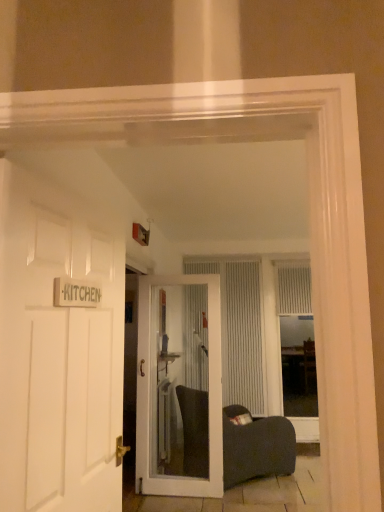
Measure the distance between point (289,294) and camera.

Point (289,294) is 5.88 meters from camera.

This screenshot has width=384, height=512. Identify the location of white textured curtain at center, the second curtain from the right. (239, 330).

Find the location of `clear glass door at center, acting as the 1th door starting from the back`. clear glass door at center, acting as the 1th door starting from the back is located at coordinates (150, 395).

This screenshot has width=384, height=512. Identify the location of white textured curtain at center, which ranks as the second curtain in left-to-right order. (294, 288).

At what (x,y) coordinates should I click in order to perform the action: click on white textured blinds at center. Please return your answer as a coordinate pair (x, y). The height and width of the screenshot is (512, 384). Looking at the image, I should click on (297, 339).

In the scene shown: Looking at the image, does white textured blinds at center seem bigger or smaller compared to white textured curtain at center, which ranks as the second curtain in left-to-right order?

white textured blinds at center is bigger than white textured curtain at center, which ranks as the second curtain in left-to-right order.

Is white textured blinds at center to the left or to the right of white textured curtain at center, acting as the first curtain starting from the right, in the image?

From the image, it's evident that white textured blinds at center is to the right of white textured curtain at center, acting as the first curtain starting from the right.

Which is in front, point (286, 397) or point (279, 274)?

The point (279, 274) is closer.

Considering the positions of objects white textured blinds at center and white textured curtain at center, acting as the first curtain starting from the right, in the image provided, who is in front, white textured blinds at center or white textured curtain at center, acting as the first curtain starting from the right,?

Positioned in front is white textured blinds at center.

Based on the photo, is white wooden door at left, the first door viewed from the front, at the back of white textured curtain at center, the second curtain from the right?

No, white textured curtain at center, the second curtain from the right, is not facing away from white wooden door at left, the first door viewed from the front.

Does white textured curtain at center, which appears as the 1th curtain when viewed from the left, have a smaller size compared to white wooden door at left, the first door viewed from the front?

Actually, white textured curtain at center, which appears as the 1th curtain when viewed from the left, might be larger than white wooden door at left, the first door viewed from the front.

Could you measure the distance between white textured curtain at center, the second curtain from the right, and white wooden door at left, the first door viewed from the front?

white textured curtain at center, the second curtain from the right, and white wooden door at left, the first door viewed from the front, are 12.99 feet apart from each other.

Between white textured curtain at center, the second curtain from the right, and white wooden door at left, the first door viewed from the front, which one has smaller width?

With smaller width is white textured curtain at center, the second curtain from the right.

In the scene shown: Is white wooden door at left, arranged as the second door when viewed from the back, next to white textured curtain at center, which ranks as the second curtain in left-to-right order, and touching it?

white wooden door at left, arranged as the second door when viewed from the back, and white textured curtain at center, which ranks as the second curtain in left-to-right order, are clearly separated.

Does white wooden door at left, arranged as the second door when viewed from the back, have a lesser width compared to white textured curtain at center, which ranks as the second curtain in left-to-right order?

Yes.

Identify the location of the 2nd curtain to the right of the white wooden door at left, arranged as the second door when viewed from the back, starting your count from the anchor. (294, 288).

Is white wooden door at left, the first door viewed from the front, not within white textured curtain at center, which ranks as the second curtain in left-to-right order?

Yes.

Between white textured blinds at center and clear glass door at center, positioned as the second door in front-to-back order, which one is positioned behind?

white textured blinds at center is behind.

What's the angular difference between white textured blinds at center and clear glass door at center, positioned as the second door in front-to-back order,'s facing directions?

The facing directions of white textured blinds at center and clear glass door at center, positioned as the second door in front-to-back order, are 5.16 degrees apart.

Is white textured blinds at center next to clear glass door at center, positioned as the second door in front-to-back order?

white textured blinds at center and clear glass door at center, positioned as the second door in front-to-back order, are not in contact.

Who is smaller, white textured blinds at center or clear glass door at center, positioned as the second door in front-to-back order?

white textured blinds at center is smaller.

Who is more distant, white textured curtain at center, which ranks as the second curtain in left-to-right order, or white textured curtain at center, the second curtain from the right?

white textured curtain at center, which ranks as the second curtain in left-to-right order, is further from the camera.

Can you confirm if white textured curtain at center, acting as the first curtain starting from the right, is smaller than white textured curtain at center, the second curtain from the right?

Yes.

From the image's perspective, is white textured curtain at center, which ranks as the second curtain in left-to-right order, located beneath white textured curtain at center, the second curtain from the right?

No, from the image's perspective, white textured curtain at center, which ranks as the second curtain in left-to-right order, is not below white textured curtain at center, the second curtain from the right.

Is white textured curtain at center, which ranks as the second curtain in left-to-right order, taller than white textured curtain at center, the second curtain from the right?

No.

Between clear glass door at center, acting as the 1th door starting from the back, and white textured blinds at center, which one appears on the left side from the viewer's perspective?

From the viewer's perspective, clear glass door at center, acting as the 1th door starting from the back, appears more on the left side.

Is there a large distance between clear glass door at center, positioned as the second door in front-to-back order, and white textured blinds at center?

Yes, clear glass door at center, positioned as the second door in front-to-back order, is far from white textured blinds at center.

Is clear glass door at center, acting as the 1th door starting from the back, turned away from white textured blinds at center?

No, clear glass door at center, acting as the 1th door starting from the back,'s orientation is not away from white textured blinds at center.

From the image's perspective, which is above, clear glass door at center, positioned as the second door in front-to-back order, or white textured blinds at center?

From the image's view, clear glass door at center, positioned as the second door in front-to-back order, is above.

Is white textured blinds at center bigger or smaller than white wooden door at left, the first door viewed from the front?

Clearly, white textured blinds at center is larger in size than white wooden door at left, the first door viewed from the front.

Considering the relative sizes of white textured blinds at center and white wooden door at left, the first door viewed from the front, in the image provided, is white textured blinds at center taller than white wooden door at left, the first door viewed from the front,?

Correct, white textured blinds at center is much taller as white wooden door at left, the first door viewed from the front.

Is white textured blinds at center to the right of white wooden door at left, the first door viewed from the front, from the viewer's perspective?

Yes.

Where is `window located behind the white wooden door at left, the first door viewed from the front`? The image size is (384, 512). window located behind the white wooden door at left, the first door viewed from the front is located at coordinates (297, 339).

This screenshot has height=512, width=384. I want to click on window that appears below the white textured curtain at center, which ranks as the second curtain in left-to-right order (from a real-world perspective), so click(297, 339).

Where is `the 2nd door in front when counting from the white textured curtain at center, the second curtain from the right`? The height and width of the screenshot is (512, 384). the 2nd door in front when counting from the white textured curtain at center, the second curtain from the right is located at coordinates (58, 354).

Consider the image. Considering their positions, is white textured curtain at center, which ranks as the second curtain in left-to-right order, positioned further to white wooden door at left, arranged as the second door when viewed from the back, than white textured blinds at center?

white textured blinds at center is further to white wooden door at left, arranged as the second door when viewed from the back.

Looking at the image, which one is located further to white textured curtain at center, which appears as the 1th curtain when viewed from the left, clear glass door at center, positioned as the second door in front-to-back order, or white textured curtain at center, which ranks as the second curtain in left-to-right order?

Among the two, clear glass door at center, positioned as the second door in front-to-back order, is located further to white textured curtain at center, which appears as the 1th curtain when viewed from the left.

Estimate the real-world distances between objects in this image. Which object is closer to white textured curtain at center, which appears as the 1th curtain when viewed from the left, white textured blinds at center or white textured curtain at center, which ranks as the second curtain in left-to-right order?

The object closer to white textured curtain at center, which appears as the 1th curtain when viewed from the left, is white textured blinds at center.

Which object lies further to the anchor point white textured curtain at center, which appears as the 1th curtain when viewed from the left, white wooden door at left, the first door viewed from the front, or white textured blinds at center?

Based on the image, white wooden door at left, the first door viewed from the front, appears to be further to white textured curtain at center, which appears as the 1th curtain when viewed from the left.

Considering their positions, is white textured curtain at center, the second curtain from the right, positioned further to clear glass door at center, acting as the 1th door starting from the back, than white textured curtain at center, which ranks as the second curtain in left-to-right order?

The object further to clear glass door at center, acting as the 1th door starting from the back, is white textured curtain at center, which ranks as the second curtain in left-to-right order.

From the image, which object appears to be nearer to white textured curtain at center, acting as the first curtain starting from the right, white textured curtain at center, which appears as the 1th curtain when viewed from the left, or white textured blinds at center?

white textured blinds at center is positioned closer to the anchor white textured curtain at center, acting as the first curtain starting from the right.

Which object lies further to the anchor point white textured curtain at center, which ranks as the second curtain in left-to-right order, white wooden door at left, the first door viewed from the front, or white textured curtain at center, the second curtain from the right?

white wooden door at left, the first door viewed from the front, is further to white textured curtain at center, which ranks as the second curtain in left-to-right order.

When comparing their distances from white wooden door at left, arranged as the second door when viewed from the back, does white textured blinds at center or white textured curtain at center, acting as the first curtain starting from the right, seem closer?

white textured curtain at center, acting as the first curtain starting from the right, is closer to white wooden door at left, arranged as the second door when viewed from the back.

Where is `curtain between white textured curtain at center, which appears as the 1th curtain when viewed from the left, and white textured blinds at center`? The height and width of the screenshot is (512, 384). curtain between white textured curtain at center, which appears as the 1th curtain when viewed from the left, and white textured blinds at center is located at coordinates (294, 288).

This screenshot has height=512, width=384. I want to click on window between clear glass door at center, acting as the 1th door starting from the back, and white textured curtain at center, the second curtain from the right, in the front-back direction, so click(297, 339).

The height and width of the screenshot is (512, 384). Find the location of `curtain between clear glass door at center, acting as the 1th door starting from the back, and white textured curtain at center, acting as the first curtain starting from the right, along the z-axis`. curtain between clear glass door at center, acting as the 1th door starting from the back, and white textured curtain at center, acting as the first curtain starting from the right, along the z-axis is located at coordinates (239, 330).

Find the location of a particular element. The image size is (384, 512). door between white wooden door at left, arranged as the second door when viewed from the back, and white textured curtain at center, which appears as the 1th curtain when viewed from the left, along the z-axis is located at coordinates (150, 395).